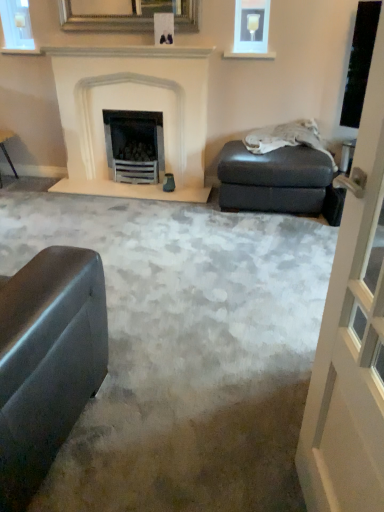
Question: From their relative heights in the image, would you say matte gray footrest at right is taller or shorter than transparent glass screen door at right?

Choices:
 (A) short
 (B) tall

Answer: (A)

Question: Looking at the image, does matte gray footrest at right seem bigger or smaller compared to transparent glass screen door at right?

Choices:
 (A) small
 (B) big

Answer: (B)

Question: Estimate the real-world distances between objects in this image. Which object is farther from the matte gray footrest at right?

Choices:
 (A) matte glass frame at upper right, the 2th picture frame viewed from the left
 (B) clear glass candle at upper left
 (C) white stone fireplace at center
 (D) gold-framed mirror at upper center, positioned as the 2th picture frame in right-to-left order
 (E) transparent glass screen door at right

Answer: (B)

Question: Which of these objects is positioned closest to the clear glass candle at upper left?

Choices:
 (A) transparent glass screen door at right
 (B) white stone fireplace at center
 (C) matte glass frame at upper right, which ranks as the first picture frame in right-to-left order
 (D) gold-framed mirror at upper center, positioned as the 2th picture frame in right-to-left order
 (E) matte gray footrest at right

Answer: (D)